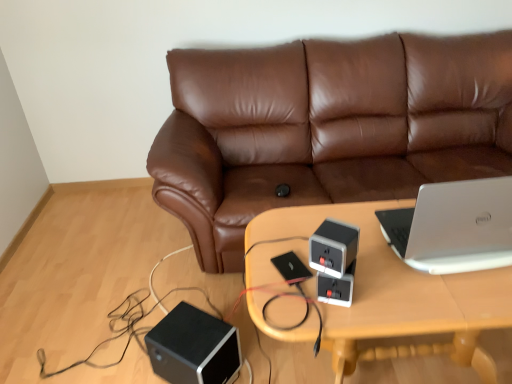
Where is `vacant space situated above wooden table at center (from a real-world perspective)`? Image resolution: width=512 pixels, height=384 pixels. vacant space situated above wooden table at center (from a real-world perspective) is located at coordinates (370, 256).